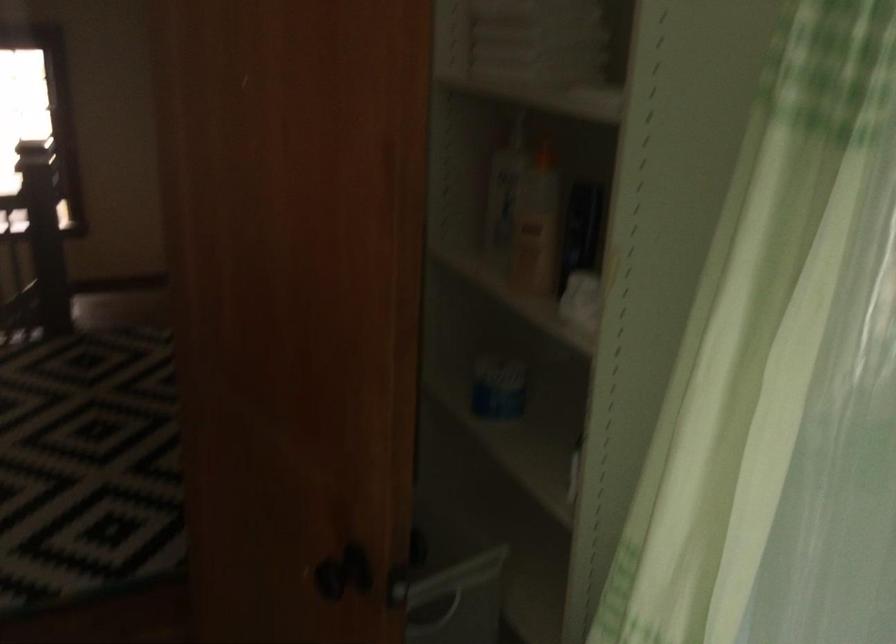
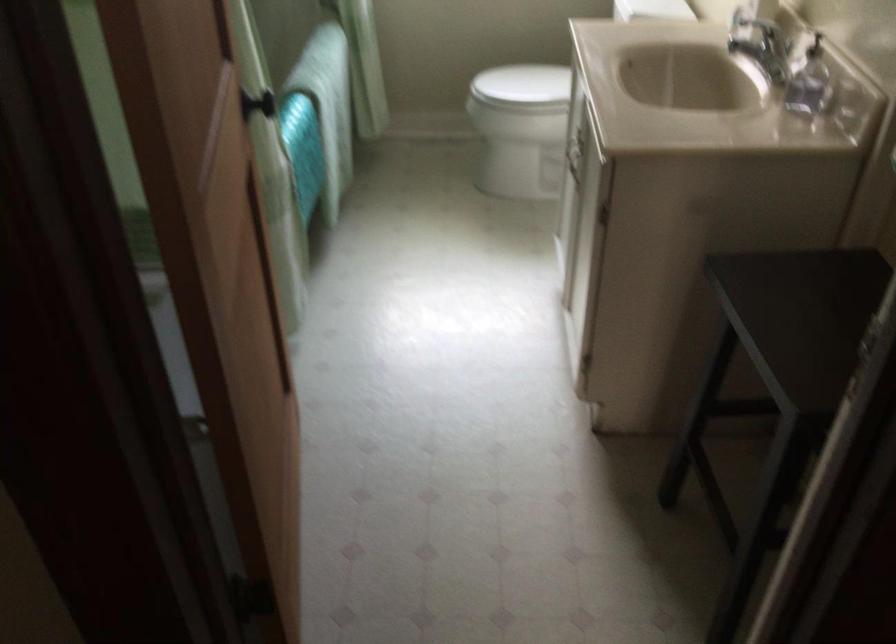
Question: I am providing you with two images of the same scene from different viewpoints. After the viewpoint changes to image2, which objects are now occluded?

Choices:
 (A) black door knob
 (B) soap dispenser pump
 (C) storage bin handle
 (D) green produce bag

Answer: (C)